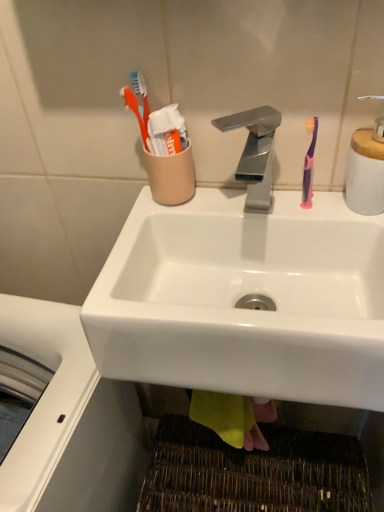
The image size is (384, 512). What do you see at coordinates (255, 153) in the screenshot? I see `polished metallic faucet at center` at bounding box center [255, 153].

What is the approximate height of white glossy sink at center?

7.10 inches.

Find the location of a particular element. The image size is (384, 512). pink plastic toothbrush at right is located at coordinates (309, 165).

Locate an element on the screen. The height and width of the screenshot is (512, 384). white ceramic soap dispenser at upper right is located at coordinates (366, 170).

How different are the orientations of white ceramic soap dispenser at upper right and pink plastic toothbrush at right in degrees?

0.0051 degrees.

Is white ceramic soap dispenser at upper right behind pink plastic toothbrush at right?

No, white ceramic soap dispenser at upper right is closer to the camera.

This screenshot has width=384, height=512. In the image, there is a white ceramic soap dispenser at upper right. Find the location of `toothbrush below it (from the image's perspective)`. toothbrush below it (from the image's perspective) is located at coordinates click(x=309, y=165).

Is white glossy sink at center oriented away from white ceramic soap dispenser at upper right?

No, white glossy sink at center is not facing the opposite direction of white ceramic soap dispenser at upper right.

Which is more to the left, white glossy sink at center or white ceramic soap dispenser at upper right?

From the viewer's perspective, white glossy sink at center appears more on the left side.

Is white glossy sink at center positioned before polished metallic faucet at center?

Yes, white glossy sink at center is closer to the camera.

In the scene shown: Is white glossy sink at center turned away from polished metallic faucet at center?

No, polished metallic faucet at center is not at the back of white glossy sink at center.

From the image's perspective, is white glossy sink at center located above or below polished metallic faucet at center?

Clearly, from the image's perspective, white glossy sink at center is below polished metallic faucet at center.

Can polished metallic faucet at center be found inside pink plastic toothbrush at right?

No.

Who is taller, pink plastic toothbrush at right or polished metallic faucet at center?

With more height is pink plastic toothbrush at right.

From the picture: From the image's perspective, is pink plastic toothbrush at right above or below polished metallic faucet at center?

pink plastic toothbrush at right is situated higher than polished metallic faucet at center in the image.

How many degrees apart are the facing directions of pink plastic toothbrush at right and polished metallic faucet at center?

There is a 0.00473-degree angle between the facing directions of pink plastic toothbrush at right and polished metallic faucet at center.

Is white ceramic soap dispenser at upper right smaller than polished metallic faucet at center?

A: Yes, white ceramic soap dispenser at upper right is smaller than polished metallic faucet at center.

Is white ceramic soap dispenser at upper right wider than polished metallic faucet at center?

No, white ceramic soap dispenser at upper right is not wider than polished metallic faucet at center.

Find the location of a particular element. This screenshot has height=512, width=384. soap dispenser above the polished metallic faucet at center (from a real-world perspective) is located at coordinates (366, 170).

Is white glossy sink at center thinner than pink plastic toothbrush at right?

No, white glossy sink at center is not thinner than pink plastic toothbrush at right.

Considering the positions of objects white glossy sink at center and pink plastic toothbrush at right in the image provided, who is more to the right, white glossy sink at center or pink plastic toothbrush at right?

pink plastic toothbrush at right.

Is white glossy sink at center further to camera compared to pink plastic toothbrush at right?

No.

You are a GUI agent. You are given a task and a screenshot of the screen. Output one action in this format:
    pyautogui.click(x=<x>, y=<y>)
    Task: Click on the tap that is above the white glossy sink at center (from a real-world perspective)
    The height and width of the screenshot is (512, 384).
    Given the screenshot: What is the action you would take?
    pyautogui.click(x=255, y=153)

From a real-world perspective, is polished metallic faucet at center above or below white glossy sink at center?

polished metallic faucet at center is above white glossy sink at center.

From the image's perspective, is polished metallic faucet at center located beneath white glossy sink at center?

Incorrect, from the image's perspective, polished metallic faucet at center is higher than white glossy sink at center.

I want to click on soap dispenser lying in front of the pink plastic toothbrush at right, so click(x=366, y=170).

Identify the location of soap dispenser above the white glossy sink at center (from a real-world perspective). Image resolution: width=384 pixels, height=512 pixels. (366, 170).

Considering their positions, is white glossy sink at center positioned further to polished metallic faucet at center than white ceramic soap dispenser at upper right?

Based on the image, white glossy sink at center appears to be further to polished metallic faucet at center.

Estimate the real-world distances between objects in this image. Which object is closer to polished metallic faucet at center, pink plastic toothbrush at right or white ceramic soap dispenser at upper right?

pink plastic toothbrush at right is positioned closer to the anchor polished metallic faucet at center.

When comparing their distances from pink plastic toothbrush at right, does polished metallic faucet at center or white glossy sink at center seem further?

Based on the image, white glossy sink at center appears to be further to pink plastic toothbrush at right.

Estimate the real-world distances between objects in this image. Which object is further from polished metallic faucet at center, white ceramic soap dispenser at upper right or white glossy sink at center?

The object further to polished metallic faucet at center is white glossy sink at center.

Considering their positions, is white glossy sink at center positioned further to white ceramic soap dispenser at upper right than pink plastic toothbrush at right?

white glossy sink at center.

From the image, which object appears to be nearer to white glossy sink at center, pink plastic toothbrush at right or polished metallic faucet at center?

polished metallic faucet at center.

From the image, which object appears to be farther from pink plastic toothbrush at right, white ceramic soap dispenser at upper right or white glossy sink at center?

Based on the image, white glossy sink at center appears to be further to pink plastic toothbrush at right.

In the scene shown: Looking at the image, which one is located closer to white glossy sink at center, white ceramic soap dispenser at upper right or polished metallic faucet at center?

polished metallic faucet at center lies closer to white glossy sink at center than the other object.

Identify the location of toothbrush situated between polished metallic faucet at center and white ceramic soap dispenser at upper right from left to right. This screenshot has height=512, width=384. (309, 165).

You are a GUI agent. You are given a task and a screenshot of the screen. Output one action in this format:
    pyautogui.click(x=<x>, y=<y>)
    Task: Click on the tap between white ceramic soap dispenser at upper right and white glossy sink at center in the up-down direction
    The width and height of the screenshot is (384, 512).
    Given the screenshot: What is the action you would take?
    pyautogui.click(x=255, y=153)

At what (x,y) coordinates should I click in order to perform the action: click on toothbrush that lies between white ceramic soap dispenser at upper right and white glossy sink at center from top to bottom. Please return your answer as a coordinate pair (x, y). Looking at the image, I should click on (309, 165).

The image size is (384, 512). Find the location of `tap between pink plastic toothbrush at right and white glossy sink at center in the up-down direction`. tap between pink plastic toothbrush at right and white glossy sink at center in the up-down direction is located at coordinates (255, 153).